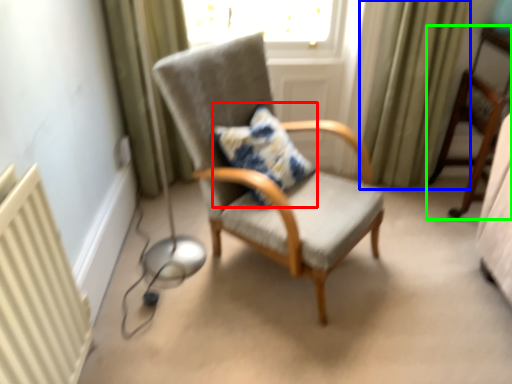
Question: Estimate the real-world distances between objects in this image. Which object is farther from pillow (highlighted by a red box), curtain (highlighted by a blue box) or chair (highlighted by a green box)?

Choices:
 (A) curtain
 (B) chair

Answer: (B)